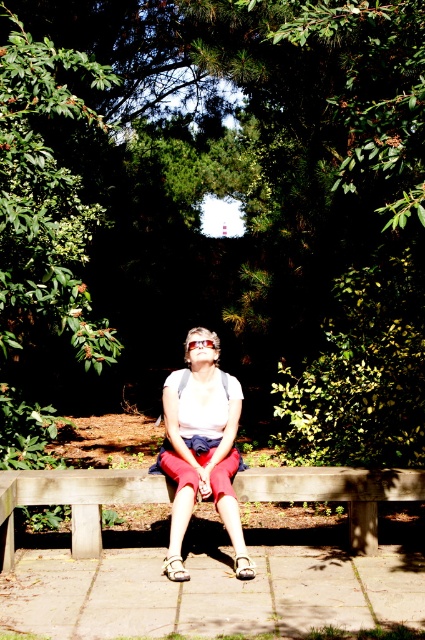
Question: Which of the following is the farthest from the observer?

Choices:
 (A) matte white shirt at center
 (B) wooden bench at center

Answer: (A)

Question: Is green leafy tree at center further to camera compared to transparent plastic goggles at center?

Choices:
 (A) no
 (B) yes

Answer: (A)

Question: Is green leafy tree at center positioned at the back of transparent plastic goggles at center?

Choices:
 (A) no
 (B) yes

Answer: (A)

Question: Based on their relative distances, which object is farther from the transparent plastic goggles at center?

Choices:
 (A) matte white shirt at center
 (B) wooden bench at center
 (C) green leafy tree at center

Answer: (C)

Question: Estimate the real-world distances between objects in this image. Which object is farther from the transparent plastic goggles at center?

Choices:
 (A) green leafy tree at center
 (B) matte white shirt at center
 (C) wooden bench at center

Answer: (A)

Question: Is wooden bench at center below matte white shirt at center?

Choices:
 (A) yes
 (B) no

Answer: (A)